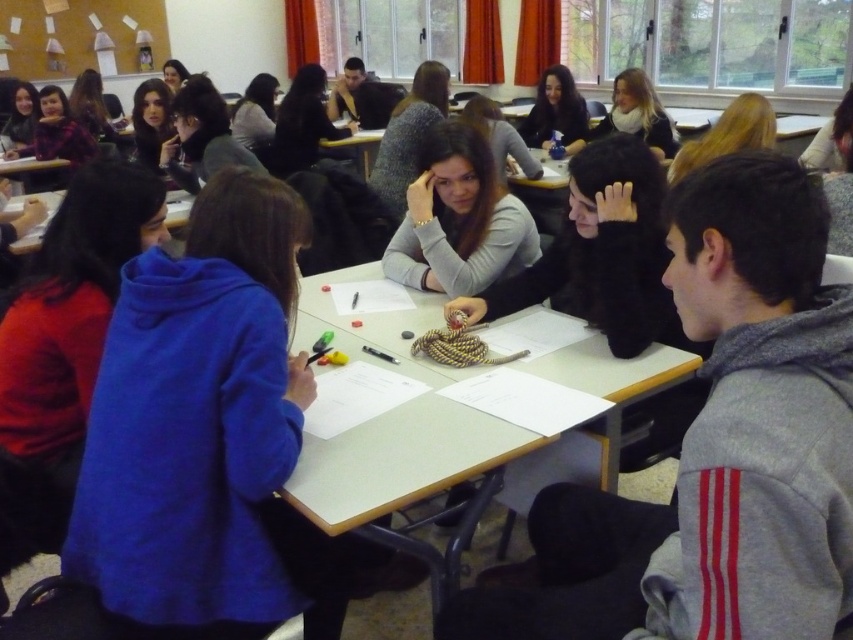
Is gray matte sweater at center further to camera compared to light brown hair at upper center?

No.

Is the position of gray matte sweater at center less distant than that of light brown hair at upper center?

That is True.

Is point (456, 240) positioned after point (662, 109)?

No.

This screenshot has height=640, width=853. What are the coordinates of `gray matte sweater at center` in the screenshot? It's located at (457, 220).

Can you confirm if smooth white table at center is taller than light brown hair at upper center?

Indeed, smooth white table at center has a greater height compared to light brown hair at upper center.

Who is lower down, smooth white table at center or light brown hair at upper center?

smooth white table at center

In order to click on smooth white table at center in this screenshot , I will do `click(399, 460)`.

From the picture: Is matte black hair at upper center further to the viewer compared to white paper at center?

That is True.

Which is behind, point (566, 99) or point (183, 212)?

The point (566, 99) is behind.

Describe the element at coordinates (555, 109) in the screenshot. I see `matte black hair at upper center` at that location.

At what (x,y) coordinates should I click in order to perform the action: click on matte black hair at upper center. Please return your answer as a coordinate pair (x, y). Looking at the image, I should click on (555, 109).